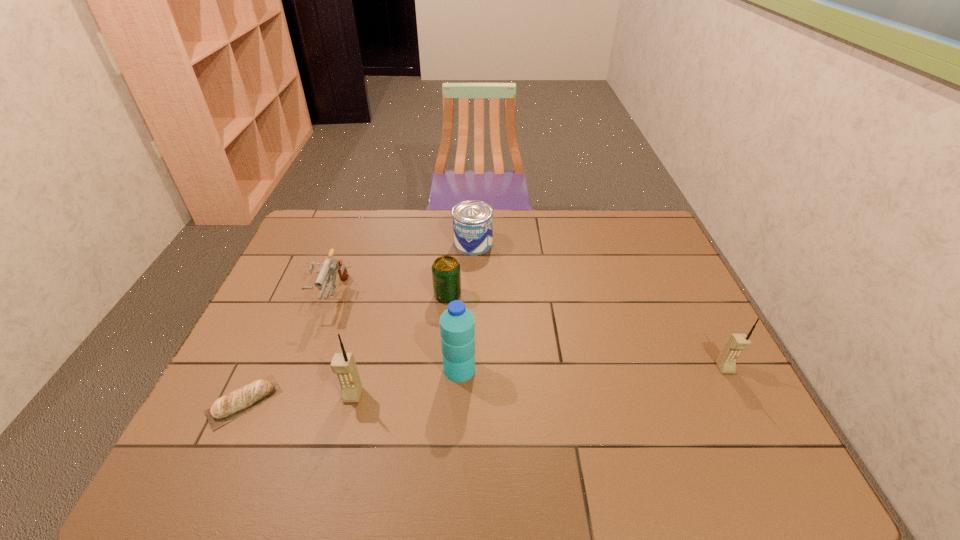
The width and height of the screenshot is (960, 540). I want to click on pita bread that is positioned at the left edge, so click(226, 408).

Locate an element on the screen. object that is at the right edge is located at coordinates (726, 361).

Where is `object that is at the near left corner`? This screenshot has width=960, height=540. object that is at the near left corner is located at coordinates (226, 408).

Where is `vacant region at the far edge of the desktop`? The width and height of the screenshot is (960, 540). vacant region at the far edge of the desktop is located at coordinates (424, 239).

Image resolution: width=960 pixels, height=540 pixels. I want to click on vacant region at the near edge, so click(x=419, y=417).

Locate an element on the screen. This screenshot has height=540, width=960. free space at the left edge of the desktop is located at coordinates (310, 324).

The image size is (960, 540). In order to click on free space at the right edge in this screenshot , I will do `click(659, 255)`.

Identify the location of free space at the far right corner of the desktop. The image size is (960, 540). (615, 220).

Identify the location of free space between the beer can and the rightmost object. This screenshot has height=540, width=960. (587, 332).

Locate an element on the screen. The width and height of the screenshot is (960, 540). free space between the can and the gun is located at coordinates [402, 269].